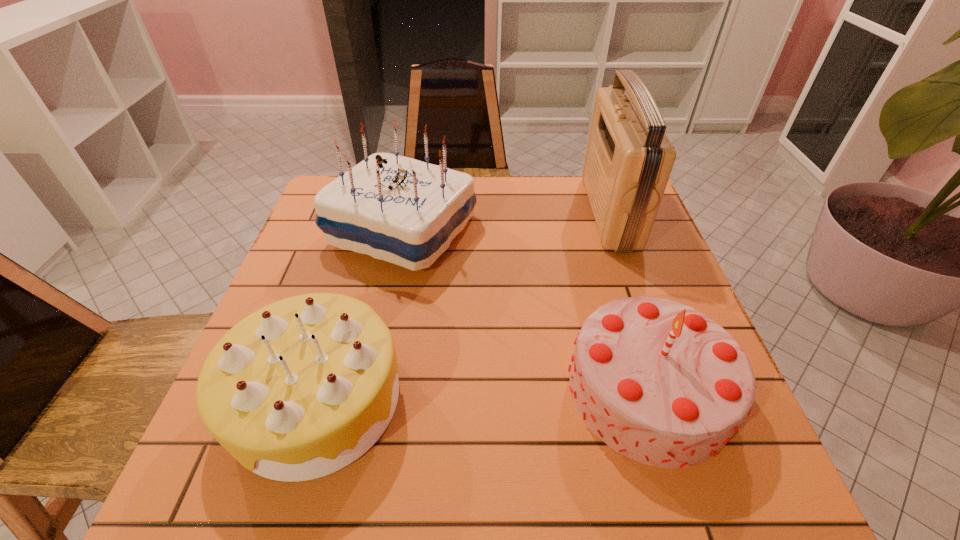
At what (x,y) coordinates should I click in order to perform the action: click on vacant space at the far edge of the desktop. Please return your answer as a coordinate pair (x, y). The image size is (960, 540). Looking at the image, I should click on (559, 183).

I want to click on free region at the near edge, so click(549, 461).

You are a GUI agent. You are given a task and a screenshot of the screen. Output one action in this format:
    pyautogui.click(x=<x>, y=<y>)
    Task: Click on the vacant space at the left edge of the desktop
    This screenshot has width=960, height=540.
    Given the screenshot: What is the action you would take?
    pyautogui.click(x=297, y=264)

The width and height of the screenshot is (960, 540). I want to click on free space that is in between the second shortest object and the shortest birthday cake, so click(483, 394).

This screenshot has width=960, height=540. Find the location of `empty location between the second shortest object and the shortest object`. empty location between the second shortest object and the shortest object is located at coordinates (483, 394).

The height and width of the screenshot is (540, 960). In order to click on vacant area between the shortest birthday cake and the second shortest object in this screenshot , I will do `click(483, 394)`.

You are a GUI agent. You are given a task and a screenshot of the screen. Output one action in this format:
    pyautogui.click(x=<x>, y=<y>)
    Task: Click on the blank region between the second tallest birthday cake and the shortest birthday cake
    
    Given the screenshot: What is the action you would take?
    pyautogui.click(x=483, y=394)

Identify which object is located as the third nearest to the tallest object. Please provide its 2D coordinates. Your answer should be formatted as a tuple, i.e. [(x, y)], where the tuple contains the x and y coordinates of a point satisfying the conditions above.

[(299, 389)]

Image resolution: width=960 pixels, height=540 pixels. Find the location of `the closest object relative to the rightmost birthday cake`. the closest object relative to the rightmost birthday cake is located at coordinates coord(398,209).

Select which birthday cake appears as the second closest to the radio receiver. Please provide its 2D coordinates. Your answer should be formatted as a tuple, i.e. [(x, y)], where the tuple contains the x and y coordinates of a point satisfying the conditions above.

[(398, 209)]